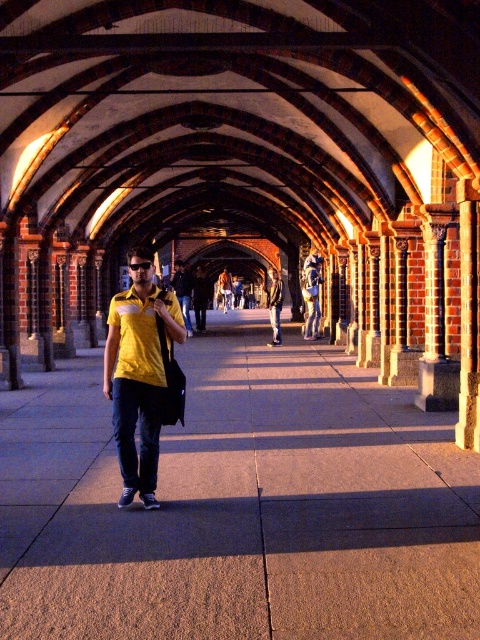
Does concrete pavement at center lie in front of denim pants at center?

Yes.

Describe the element at coordinates (240, 504) in the screenshot. I see `concrete pavement at center` at that location.

What are the coordinates of `concrete pavement at center` in the screenshot? It's located at (240, 504).

Between point (191, 448) and point (126, 358), which one is positioned in front?

Point (126, 358) is more forward.

This screenshot has width=480, height=640. Describe the element at coordinates (240, 504) in the screenshot. I see `concrete pavement at center` at that location.

Where is `concrete pavement at center`? The height and width of the screenshot is (640, 480). concrete pavement at center is located at coordinates (240, 504).

The image size is (480, 640). Find the location of `concrete pavement at center`. concrete pavement at center is located at coordinates [240, 504].

Is matte yellow shirt at center thinner than denim pants at center?

Correct, matte yellow shirt at center's width is less than denim pants at center's.

Can you confirm if matte yellow shirt at center is positioned below denim pants at center?

Yes, matte yellow shirt at center is below denim pants at center.

At what (x,y) coordinates should I click in order to perform the action: click on matte yellow shirt at center. Please return your answer as a coordinate pair (x, y). The width and height of the screenshot is (480, 640). Looking at the image, I should click on (139, 372).